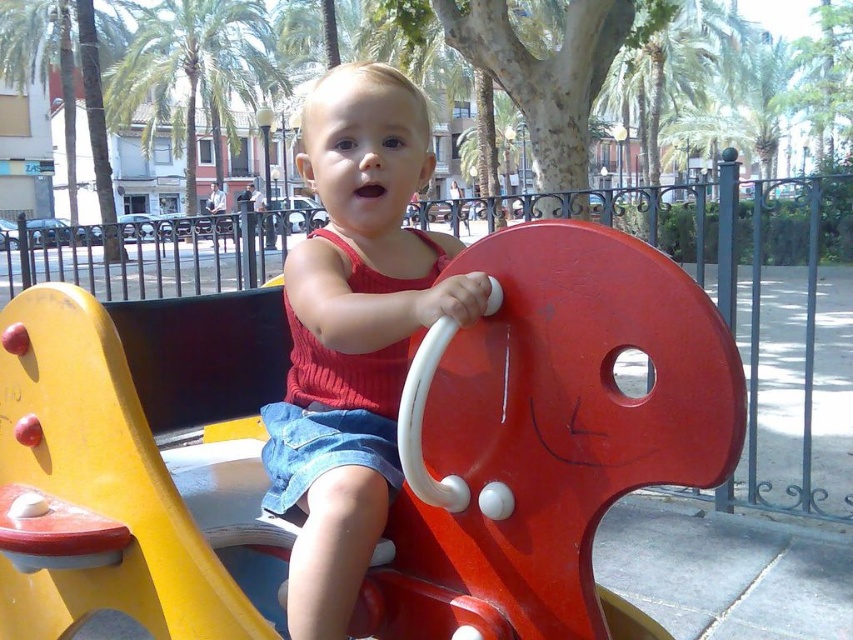
Question: Is matte plastic horse at center to the left of matte red swing at center from the viewer's perspective?

Choices:
 (A) yes
 (B) no

Answer: (A)

Question: Which object appears farthest from the camera in this image?

Choices:
 (A) matte plastic horse at center
 (B) green leafy palm tree at upper left

Answer: (B)

Question: Which point is closer to the camera taking this photo?

Choices:
 (A) 265,566
 (B) 296,339
 (C) 260,76

Answer: (A)

Question: Considering the real-world distances, which object is closest to the green leafy palm tree at upper left?

Choices:
 (A) matte plastic horse at center
 (B) matte red swing at center

Answer: (A)

Question: Does matte plastic horse at center have a smaller size compared to green leafy palm tree at upper left?

Choices:
 (A) yes
 (B) no

Answer: (A)

Question: Is matte plastic horse at center thinner than matte red swing at center?

Choices:
 (A) no
 (B) yes

Answer: (A)